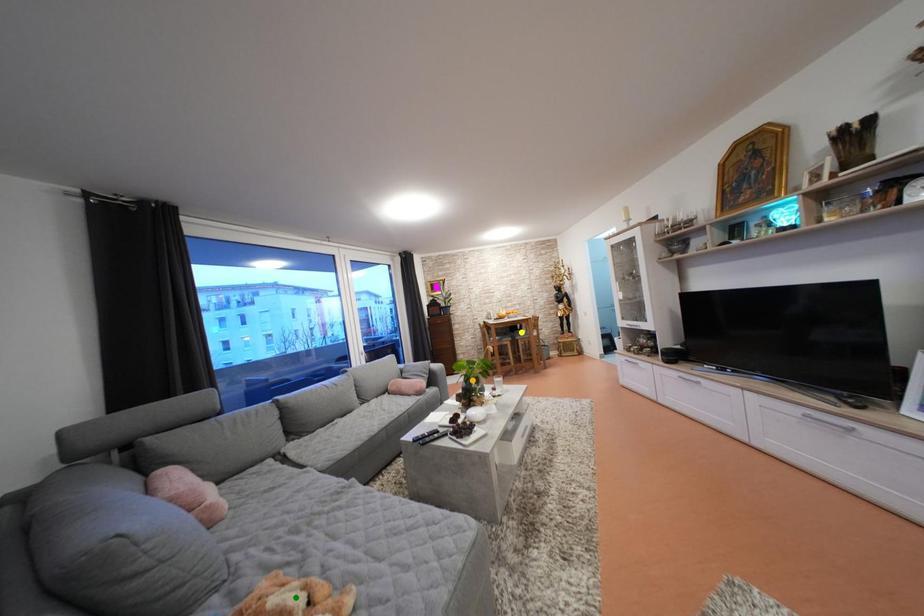
Order these from nearest to farthest:
A) yellow point
B) green point
C) orange point

green point
orange point
yellow point